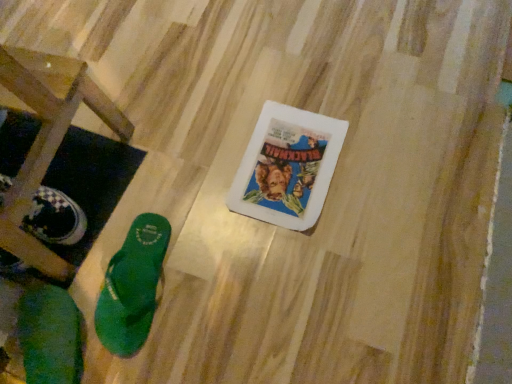
Where is `vacant space in green rubber flip-flop at lower left, acting as the 2th footwear starting from the left (from a real-world perspective)`? vacant space in green rubber flip-flop at lower left, acting as the 2th footwear starting from the left (from a real-world perspective) is located at coordinates (137, 269).